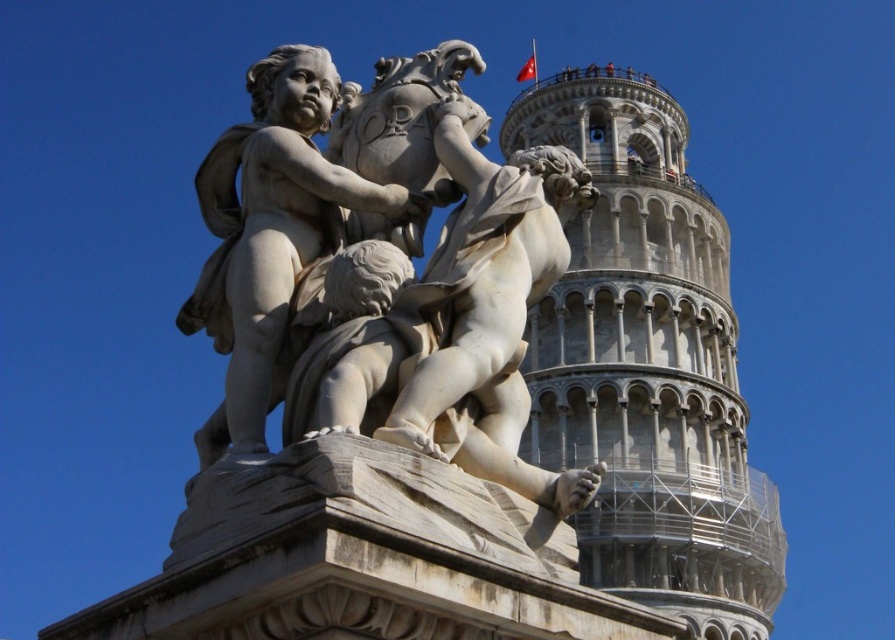
Is white marble sculpture at center positioned before white stone tower at center?

Yes.

Between white marble sculpture at center and white stone tower at center, which one is positioned lower?

white marble sculpture at center is below.

Does point (561, 234) come in front of point (663, 442)?

Yes.

At what (x,y) coordinates should I click in order to perform the action: click on white marble sculpture at center. Please return your answer as a coordinate pair (x, y). Looking at the image, I should click on (380, 310).